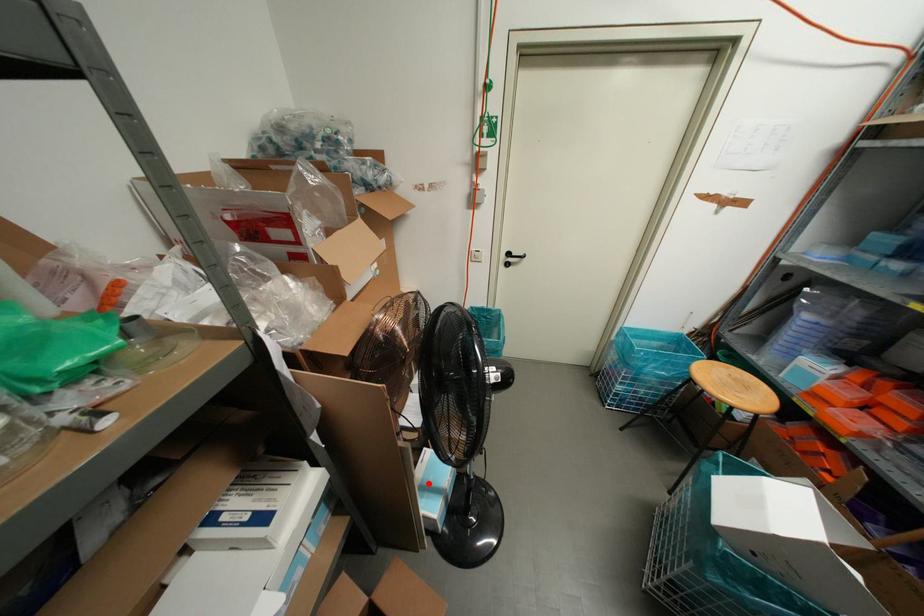
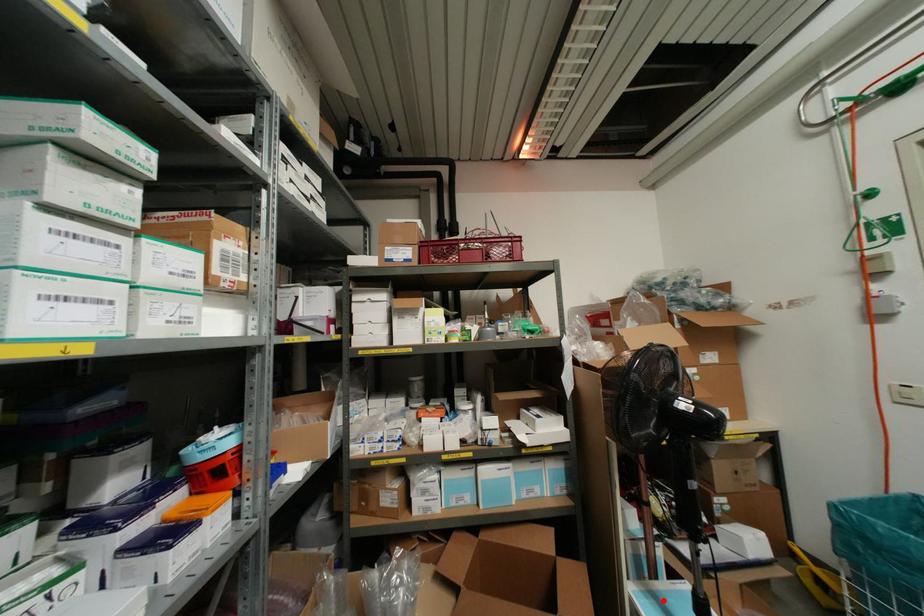
I am providing you with two images of the same scene from different viewpoints. A red point is marked on the first image and another point is marked on the second image. Are the points marked in image1 and image2 representing the same 3D position?

Yes